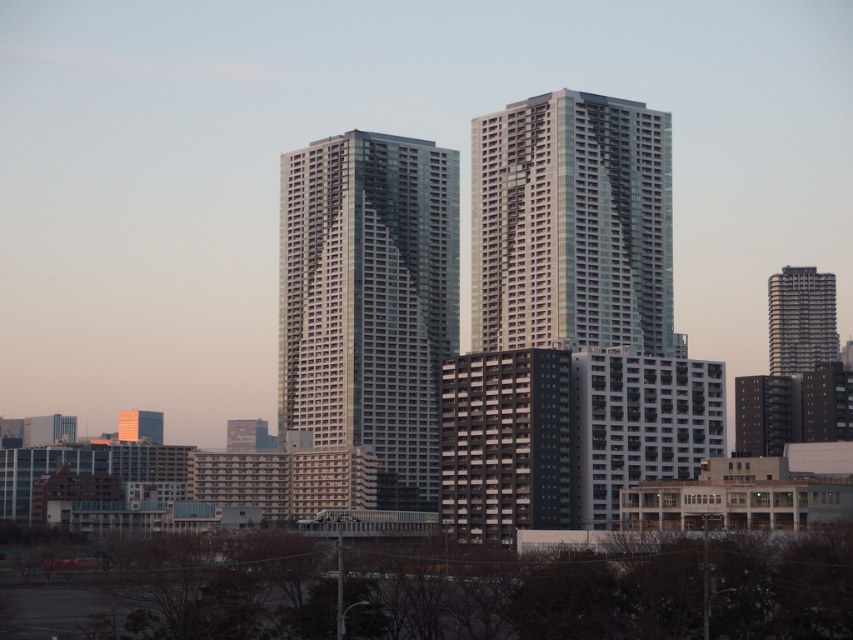
Between metallic silver building at right and orange glass tower at lower left, which one is positioned higher?

metallic silver building at right

In the scene shown: Can you confirm if metallic silver building at right is bigger than orange glass tower at lower left?

Correct, metallic silver building at right is larger in size than orange glass tower at lower left.

Locate an element on the screen. metallic silver building at right is located at coordinates (799, 320).

Does glossy glass building at center appear on the left side of orange glass tower at lower left?

In fact, glossy glass building at center is to the right of orange glass tower at lower left.

Find the location of a particular element. This screenshot has height=640, width=853. glossy glass building at center is located at coordinates (572, 225).

The height and width of the screenshot is (640, 853). In order to click on glossy glass building at center in this screenshot , I will do `click(572, 225)`.

Consider the image. Does glassy metallic building at center appear on the left side of orange glass tower at lower left?

In fact, glassy metallic building at center is to the right of orange glass tower at lower left.

Where is `glassy metallic building at center`? glassy metallic building at center is located at coordinates (369, 300).